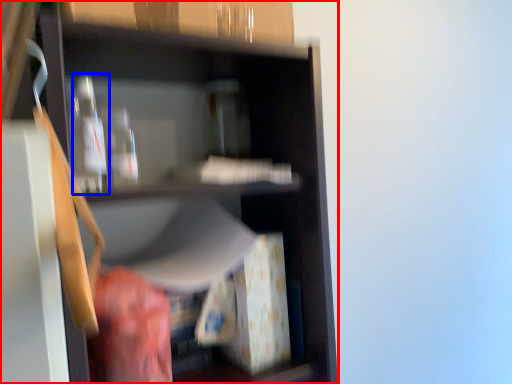
Question: Which point is further to the camera, shelf (highlighted by a red box) or bottle (highlighted by a blue box)?

Choices:
 (A) shelf
 (B) bottle

Answer: (B)